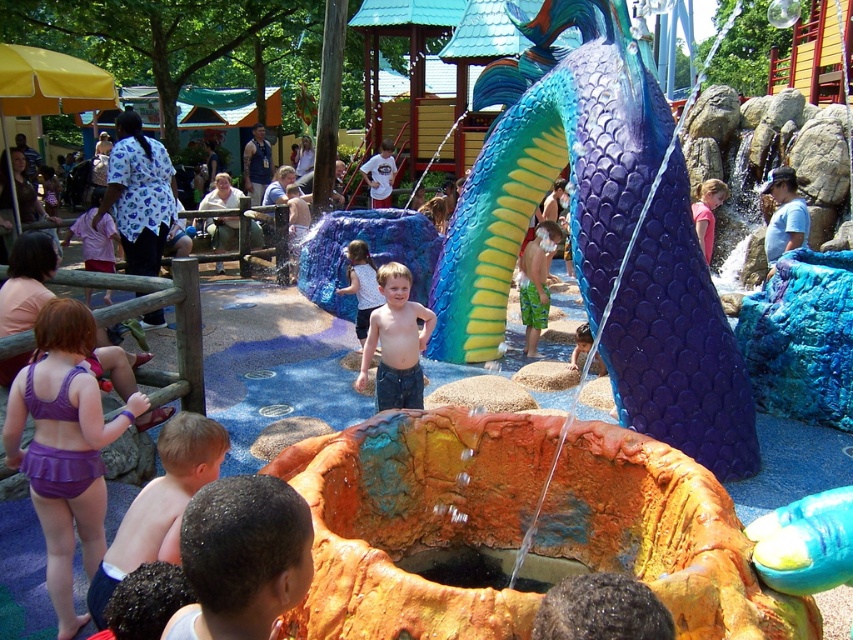
You are standing at the point with coordinates point (393, 333) and want to walk towards the mermaid tail water feature. Which direction should you go to reach the point (13, 408), which is closer to the water feature?

You should walk towards the point (13, 408) because it is in front of point (393, 333) and closer to the water feature.